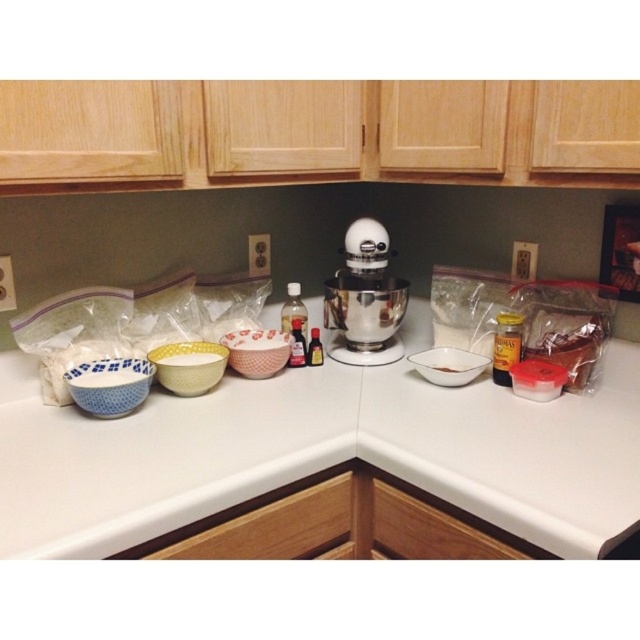
Does white metallic stand mixer at center lie behind white polka dot bowl at center?

Yes, it is behind white polka dot bowl at center.

Who is taller, white metallic stand mixer at center or white polka dot bowl at center?

With more height is white metallic stand mixer at center.

This screenshot has width=640, height=640. I want to click on white metallic stand mixer at center, so click(365, 298).

Between white metallic stand mixer at center and pink floral ceramic mixing bowl at center, which one appears on the left side from the viewer's perspective?

Positioned to the left is pink floral ceramic mixing bowl at center.

Is white metallic stand mixer at center wider than pink floral ceramic mixing bowl at center?

Correct, the width of white metallic stand mixer at center exceeds that of pink floral ceramic mixing bowl at center.

Describe the element at coordinates (365, 298) in the screenshot. The height and width of the screenshot is (640, 640). I see `white metallic stand mixer at center` at that location.

Identify the location of white metallic stand mixer at center. This screenshot has height=640, width=640. (365, 298).

Which of these two, yellow polka dot bowl at center or pink floral ceramic mixing bowl at center, stands taller?

pink floral ceramic mixing bowl at center

Describe the element at coordinates (188, 365) in the screenshot. I see `yellow polka dot bowl at center` at that location.

I want to click on yellow polka dot bowl at center, so click(188, 365).